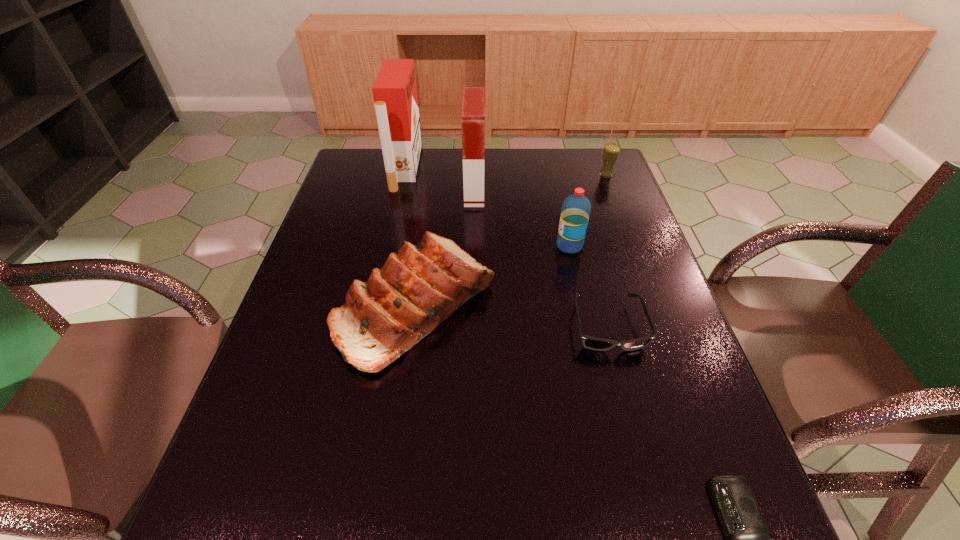
Image resolution: width=960 pixels, height=540 pixels. In order to click on object located at the far right corner in this screenshot , I will do `click(611, 151)`.

Image resolution: width=960 pixels, height=540 pixels. In the image, there is a desktop. What are the coordinates of `vacant space at the far edge` in the screenshot? It's located at (455, 156).

Identify the location of vacant space at the left edge of the desktop. This screenshot has width=960, height=540. (256, 496).

In the image, there is a desktop. Find the location of `vacant space at the right edge`. vacant space at the right edge is located at coordinates (595, 213).

Locate an element on the screen. free location at the near left corner is located at coordinates [260, 522].

Identify the location of vacant space at the far right corner of the desktop. (589, 168).

This screenshot has height=540, width=960. Find the location of `empty location between the sunglasses and the bread`. empty location between the sunglasses and the bread is located at coordinates (512, 316).

I want to click on vacant space in between the third shortest object and the sixth tallest object, so click(x=512, y=316).

Locate an element on the screen. This screenshot has width=960, height=540. free point between the water bottle and the left cigarette_case is located at coordinates (488, 207).

This screenshot has height=540, width=960. I want to click on free area in between the left cigarette_case and the water bottle, so pos(488,207).